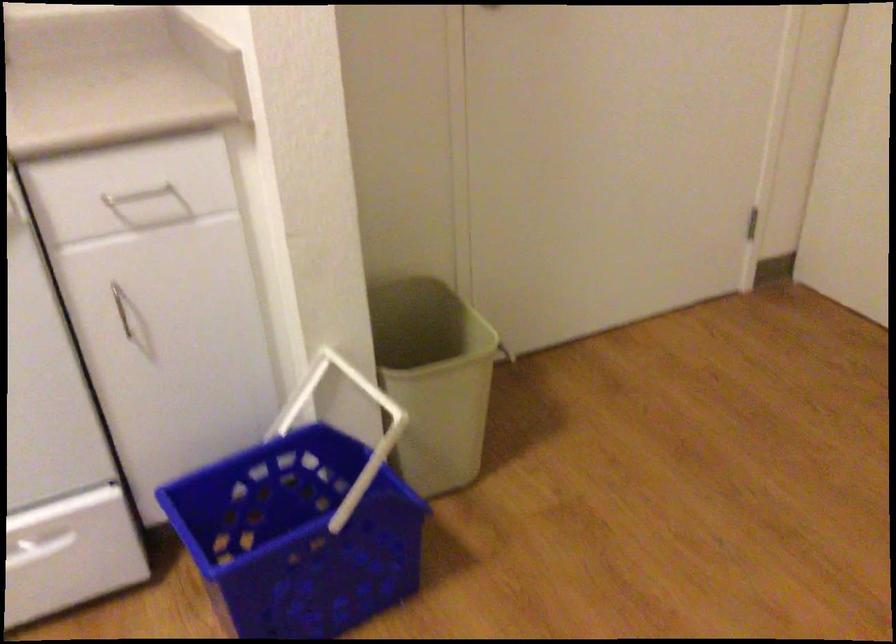
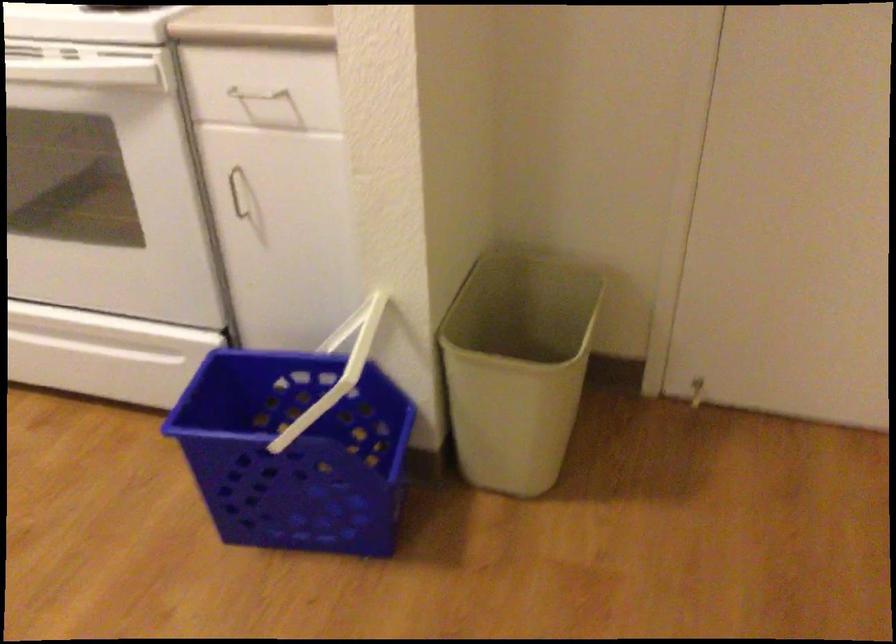
Locate, in the second image, the point that corresponds to (x=464, y=359) in the first image.

(517, 366)